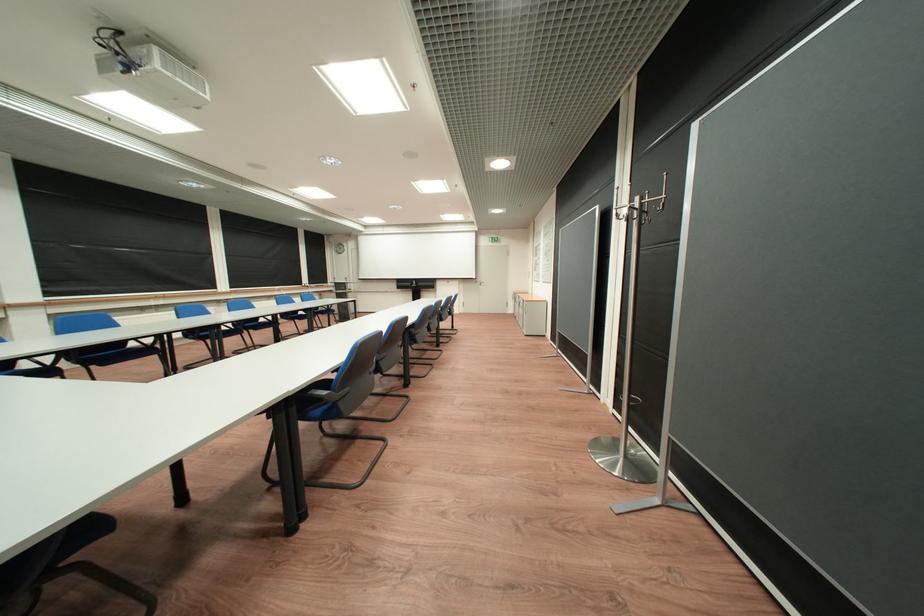
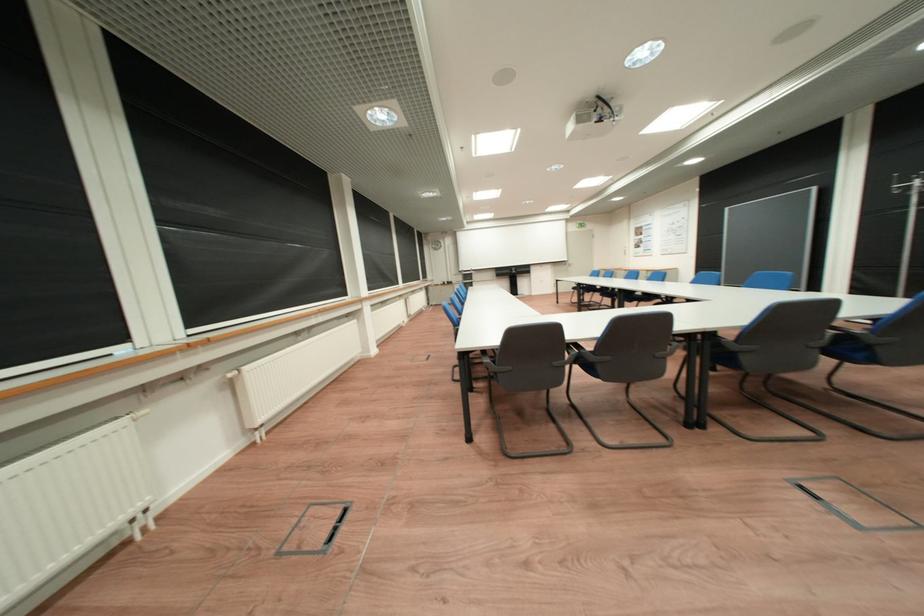
Question: I am providing you with two images of the same scene from different viewpoints. Which of the following objects are not visible in image2?

Choices:
 (A) grey chair armrest
 (B) cream box handle
 (C) blue chair sitting surface
 (D) floor box handle

Answer: (C)